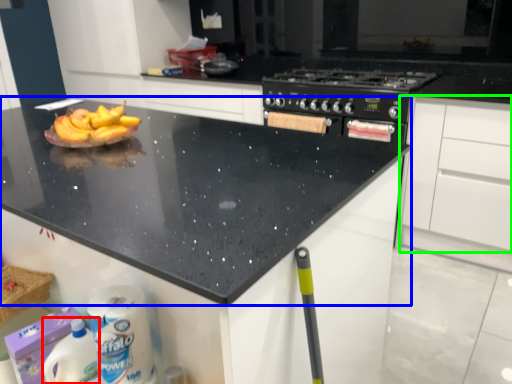
Question: Which object is the farthest from cleaning product (highlighted by a red box)? Choose among these: countertop (highlighted by a blue box) or cabinetry (highlighted by a green box).

Choices:
 (A) countertop
 (B) cabinetry

Answer: (B)